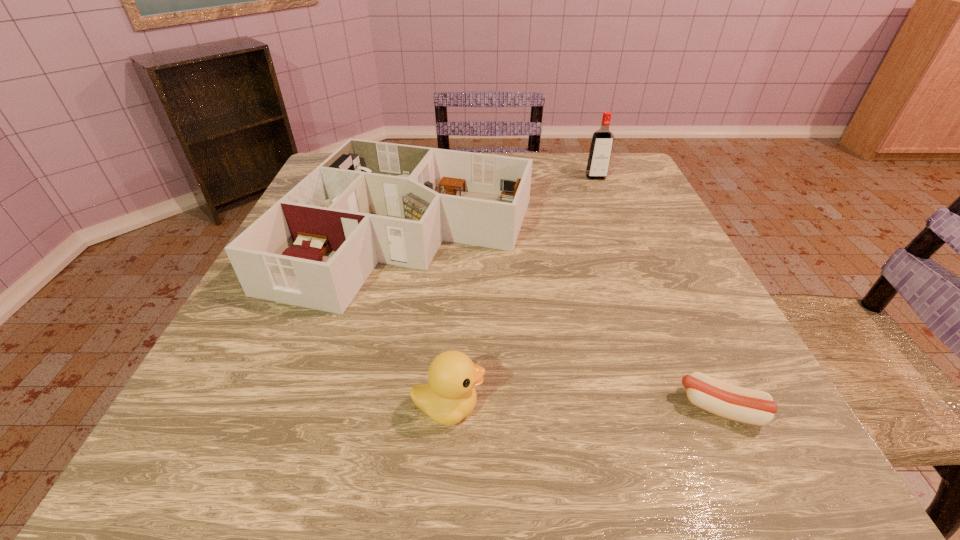
I want to click on vacant region at the left edge of the desktop, so click(x=310, y=318).

The width and height of the screenshot is (960, 540). Find the location of `free space at the right edge`. free space at the right edge is located at coordinates (661, 247).

Locate an element on the screen. The image size is (960, 540). free space at the far right corner of the desktop is located at coordinates (611, 165).

Where is `empty space between the duck and the vodka`? empty space between the duck and the vodka is located at coordinates (522, 292).

Locate an element on the screen. This screenshot has height=540, width=960. empty space that is in between the vodka and the shortest object is located at coordinates (659, 293).

At what (x,y) coordinates should I click in order to perform the action: click on vacant space in between the dollhouse and the sausage. Please return your answer as a coordinate pair (x, y). This screenshot has height=540, width=960. Looking at the image, I should click on (564, 321).

Find the location of a particular element. empty location between the duck and the dollhouse is located at coordinates (428, 320).

Image resolution: width=960 pixels, height=540 pixels. I want to click on free spot between the duck and the vodka, so click(x=522, y=292).

Identify the location of empty space between the dollhouse and the shortest object. The image size is (960, 540). (564, 321).

Where is `free space between the duck and the shortest object`? free space between the duck and the shortest object is located at coordinates [x=585, y=408].